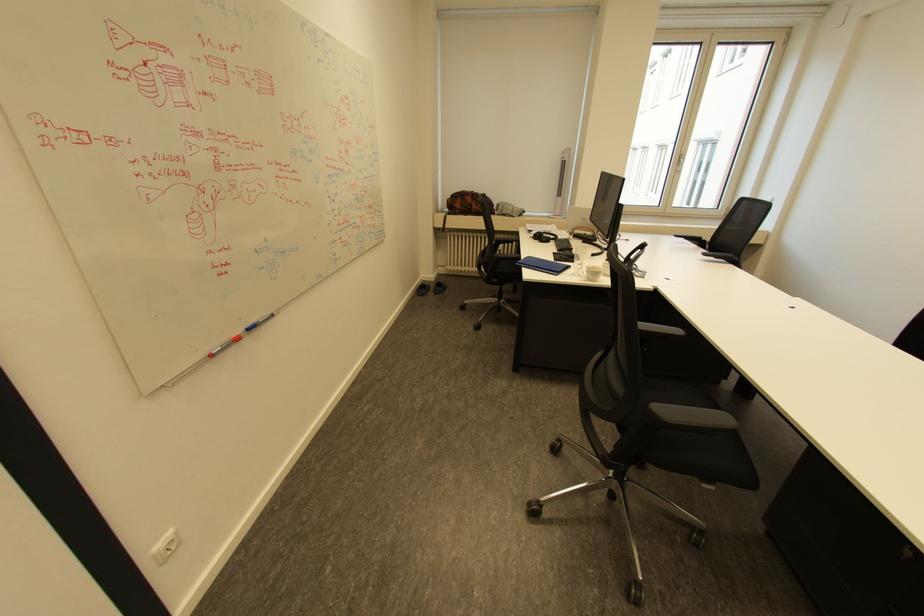
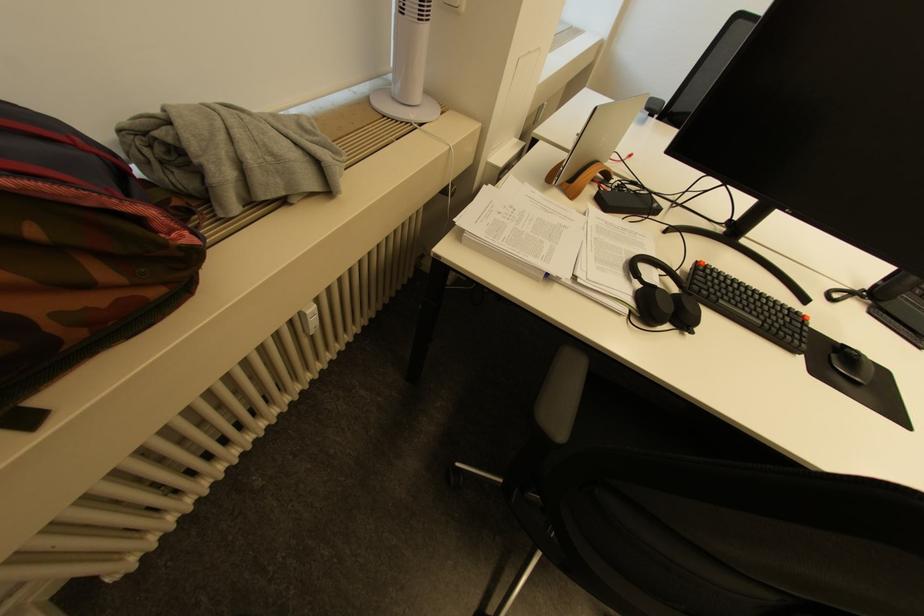
Find the pixel in the second image that matches the point at 565,251 in the first image.

(800, 351)